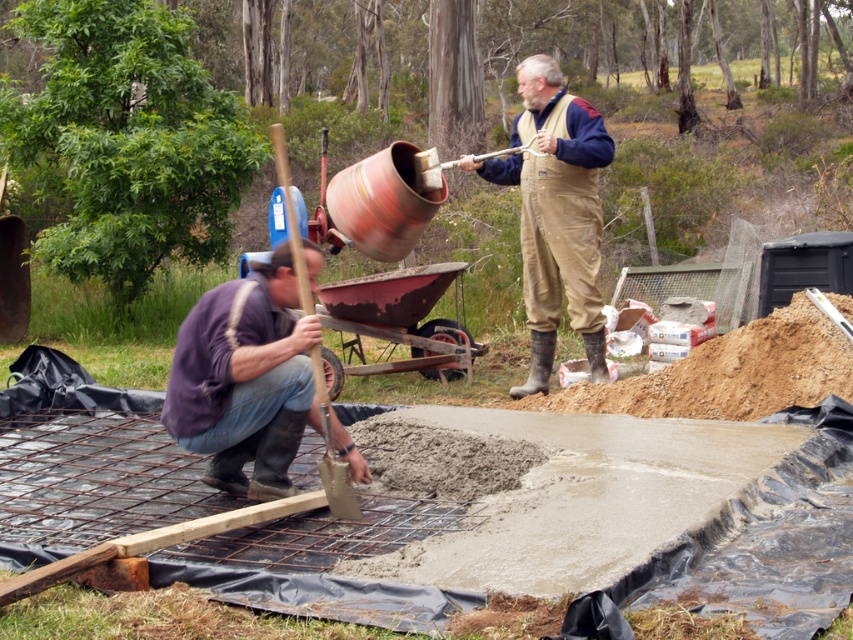
Question: Does matte purple shirt at lower left have a larger size compared to brown wooden shovel at lower left?

Choices:
 (A) yes
 (B) no

Answer: (B)

Question: Which point is closer to the camera taking this photo?

Choices:
 (A) (548, 289)
 (B) (318, 358)
 (C) (306, 243)

Answer: (B)

Question: Which object is the closest to the matte purple shirt at lower left?

Choices:
 (A) brown wooden shovel at lower left
 (B) brown/canvas overalls at center

Answer: (A)

Question: Among these objects, which one is nearest to the camera?

Choices:
 (A) matte purple shirt at lower left
 (B) brown wooden shovel at lower left
 (C) brown/canvas overalls at center

Answer: (A)

Question: From the image, what is the correct spatial relationship of matte purple shirt at lower left in relation to brown/canvas overalls at center?

Choices:
 (A) below
 (B) above

Answer: (A)

Question: Does matte purple shirt at lower left appear on the right side of brown/canvas overalls at center?

Choices:
 (A) yes
 (B) no

Answer: (B)